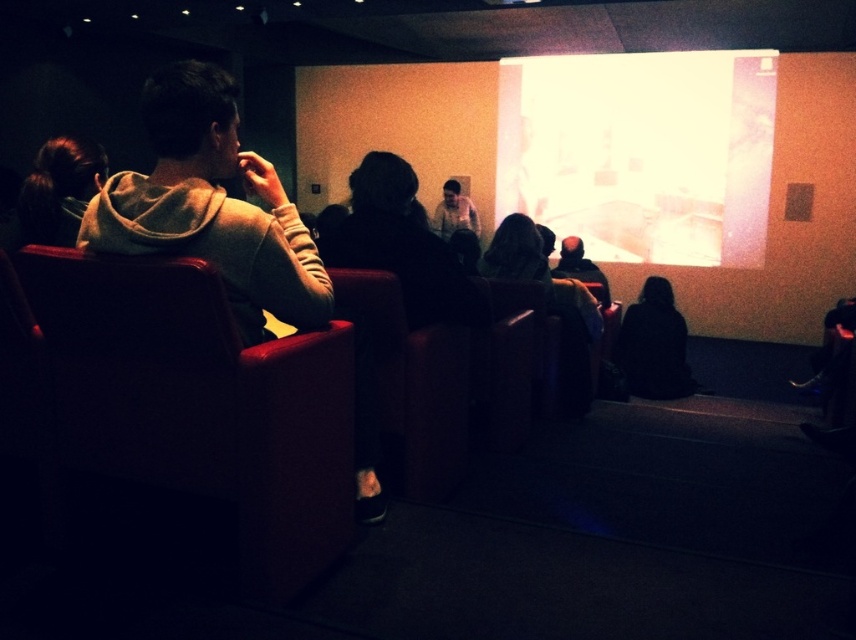
You are in a dark room with a projection screen. You see two points marked on the wall at coordinates point (290, 470) and point (87, 154). Which point is closer to you?

Point (290, 470) is closer to the camera than point (87, 154).